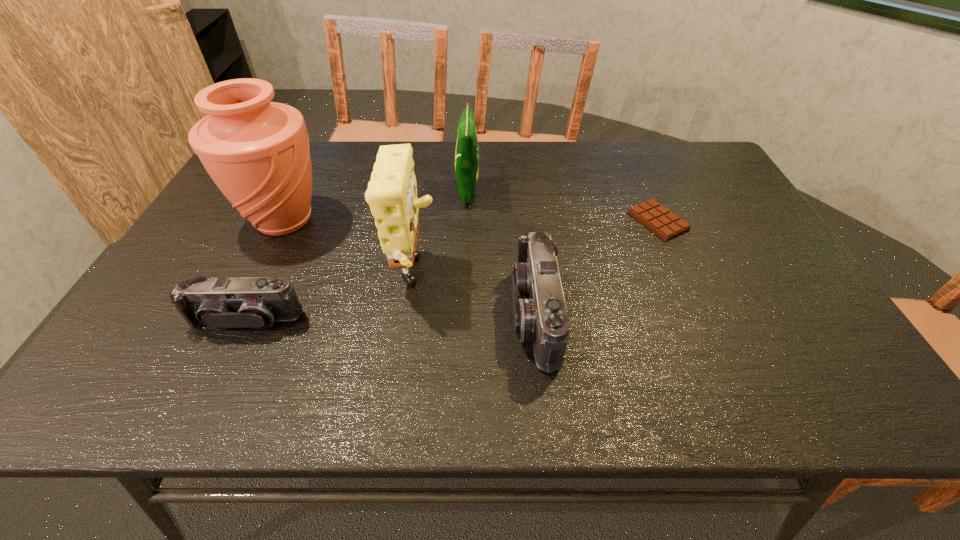
This screenshot has width=960, height=540. I want to click on vase, so click(257, 152).

At what (x,y) coordinates should I click in order to perform the action: click on vacant space located 0.310m on the front-facing side of the second object from right to left. Please return your answer as a coordinate pair (x, y). The image size is (960, 540). Looking at the image, I should click on (373, 316).

Find the location of a particular element. This screenshot has height=540, width=960. vacant space located on the front-facing side of the second object from right to left is located at coordinates (453, 316).

What are the coordinates of `free location located 0.070m on the front-facing side of the second object from right to left` in the screenshot? It's located at (480, 316).

The width and height of the screenshot is (960, 540). I want to click on vacant area situated 0.270m on the face of the second tallest object, so click(x=549, y=279).

I want to click on free space located 0.060m on the back of the rightmost object, so click(x=644, y=191).

Where is `free space located 0.340m on the front-facing side of the crisp (potato chip)`? This screenshot has height=540, width=960. free space located 0.340m on the front-facing side of the crisp (potato chip) is located at coordinates (592, 193).

Where is `vacant space situated 0.050m on the front of the tallest object`? The width and height of the screenshot is (960, 540). vacant space situated 0.050m on the front of the tallest object is located at coordinates (262, 265).

Locate an element on the screen. object positioned at the far edge is located at coordinates (466, 156).

At what (x,y) coordinates should I click in order to perform the action: click on camcorder at the left edge. Please return your answer as a coordinate pair (x, y). This screenshot has width=960, height=540. Looking at the image, I should click on (219, 303).